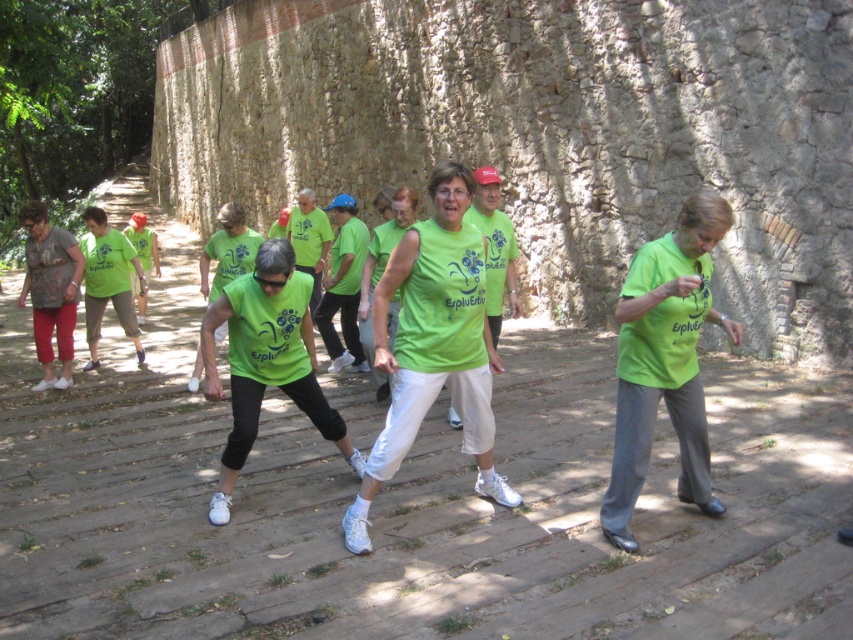
Who is more forward, (473, 394) or (41, 225)?

Point (473, 394) is more forward.

This screenshot has height=640, width=853. In order to click on green matte tank top at center in this screenshot , I will do [433, 344].

Who is more distant from viewer, (x=380, y=332) or (x=42, y=218)?

Point (x=42, y=218)

Where is `green matte tank top at center`? Image resolution: width=853 pixels, height=640 pixels. green matte tank top at center is located at coordinates (433, 344).

Measure the distance from green matte tank top at center to green matte shirt at center.

The distance of green matte tank top at center from green matte shirt at center is 31.75 inches.

Can you confirm if green matte tank top at center is shorter than green matte shirt at center?

In fact, green matte tank top at center may be taller than green matte shirt at center.

Does point (396, 253) come behind point (633, 316)?

Yes, it is behind point (633, 316).

Locate an element on the screen. green matte tank top at center is located at coordinates (x=433, y=344).

From the picture: Which is below, matte green t-shirt at left or green fabric shirt at center?

matte green t-shirt at left is below.

Can you confirm if matte green t-shirt at left is shorter than green fabric shirt at center?

Correct, matte green t-shirt at left is not as tall as green fabric shirt at center.

At what (x,y) coordinates should I click in order to perform the action: click on matte green t-shirt at left. Please return your answer as a coordinate pair (x, y). This screenshot has width=853, height=640. Looking at the image, I should click on (108, 280).

Identify the location of matte green t-shirt at left. Image resolution: width=853 pixels, height=640 pixels. (108, 280).